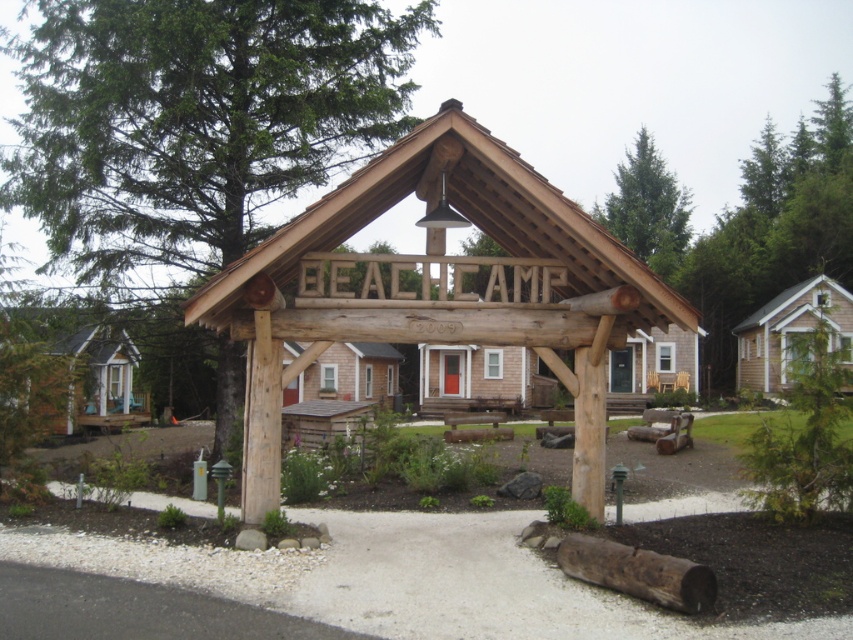
You are standing at the entrance of Beach Camp and want to know how far the point marked as point (410, 144) is from you. Can you determine the distance?

The point marked as point (410, 144) is 28.62 feet away from the viewer.

You are planning to install a new light post between the green textured tree at upper left and the natural wood sign at center. Based on their widths, which object should you consider for ensuring the light post fits appropriately?

The green textured tree at upper left might be wider than natural wood sign at center, so you should consider the width of the green textured tree at upper left to ensure the light post fits appropriately.